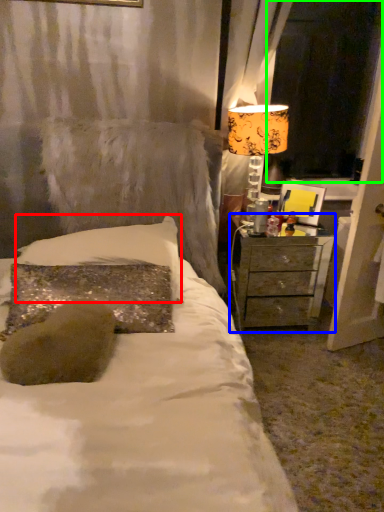
Question: Which object is the farthest from pillow (highlighted by a red box)? Choose among these: nightstand (highlighted by a blue box) or window screen (highlighted by a green box).

Choices:
 (A) nightstand
 (B) window screen

Answer: (B)